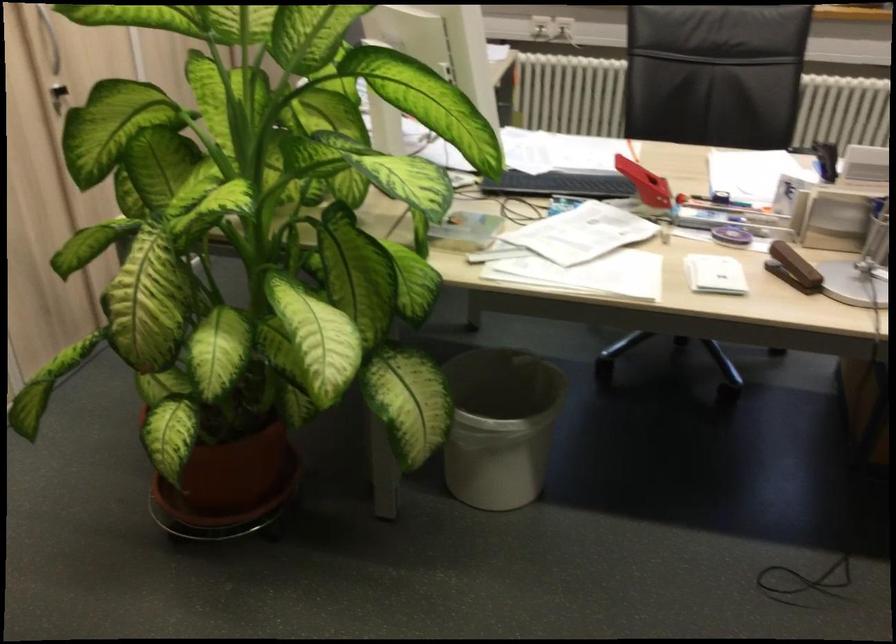
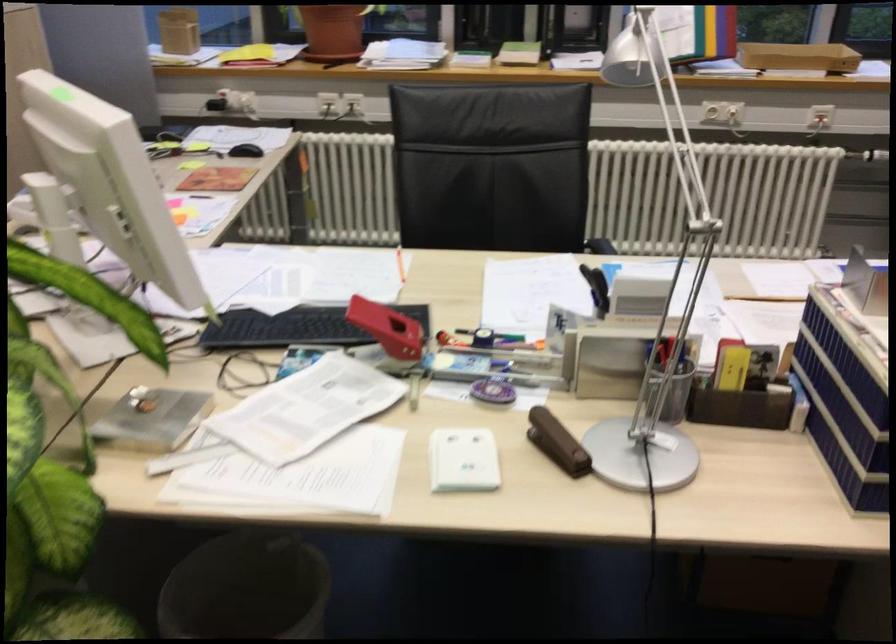
Question: The camera is either moving clockwise (left) or counter-clockwise (right) around the object. The first image is from the beginning of the video and the second image is from the end. Is the camera moving left or right when shooting the video?

Choices:
 (A) Left
 (B) Right

Answer: (A)